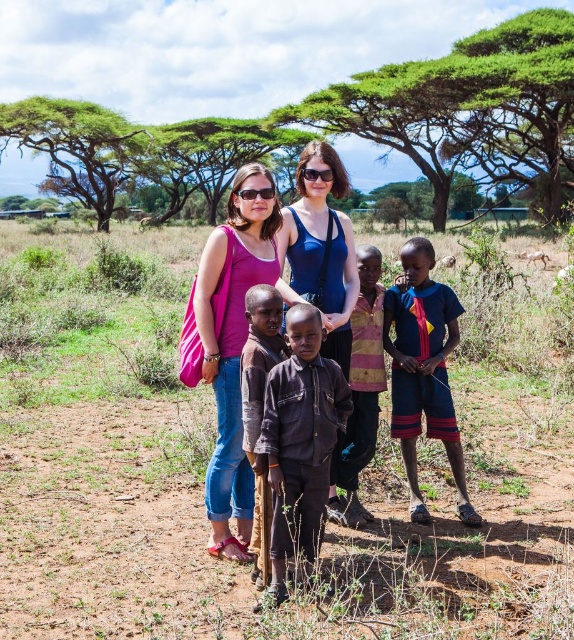
Consider the image. You are a photographer trying to capture a photo of the two adults in the scene. The pink fabric at center and the striped fabric shirt at center are both visible in your frame. Which one appears taller in the photo?

The pink fabric at center appears taller than the striped fabric shirt at center in the photo because the description states that the pink fabric at center is much taller as striped fabric shirt at center.

You are planning to set up a picnic area in the scene described. Considering the location of the green leafy tree at upper center, where should you place the picnic blanket to ensure it is in a shaded area? Please provide coordinates based on the image grid system.

The green leafy tree at upper center is located at point (222, 49). To place the picnic blanket in a shaded area, position it under the tree at those coordinates where the tree provides shade.